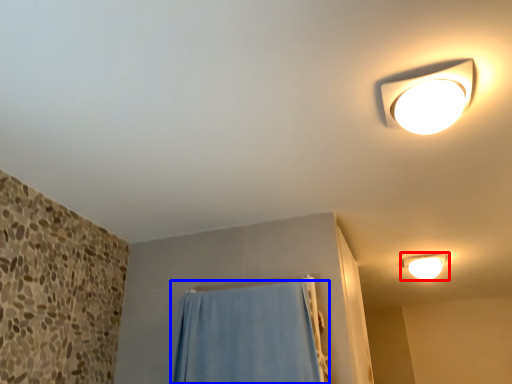
Question: Which object is further to the camera taking this photo, lamp (highlighted by a red box) or curtain (highlighted by a blue box)?

Choices:
 (A) lamp
 (B) curtain

Answer: (A)